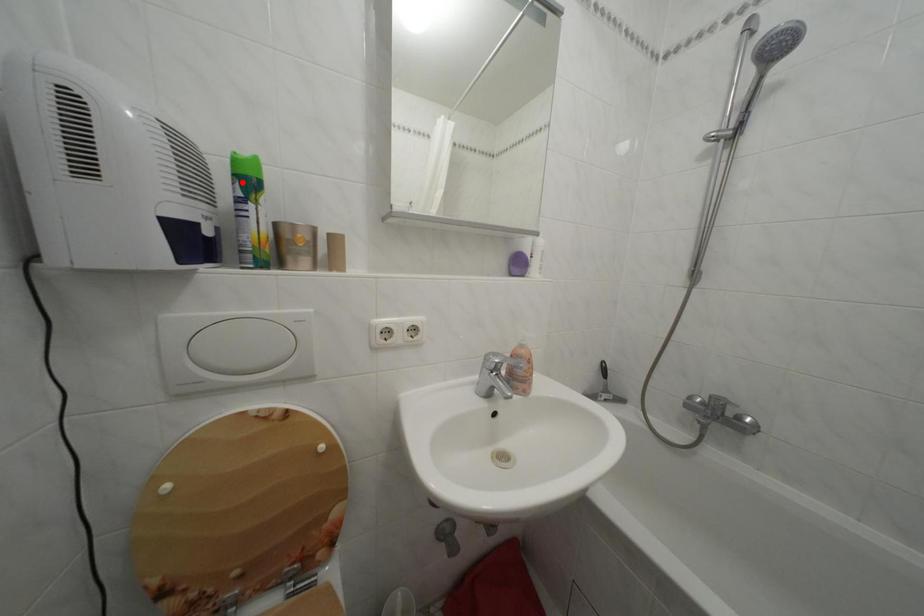
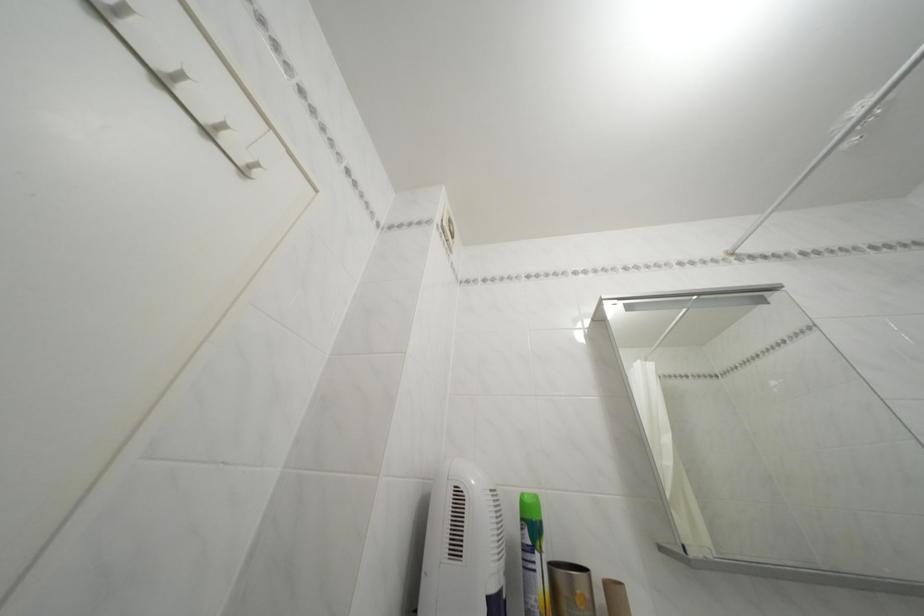
The point at the highlighted location is marked in the first image. Where is the corresponding point in the second image?

(531, 525)